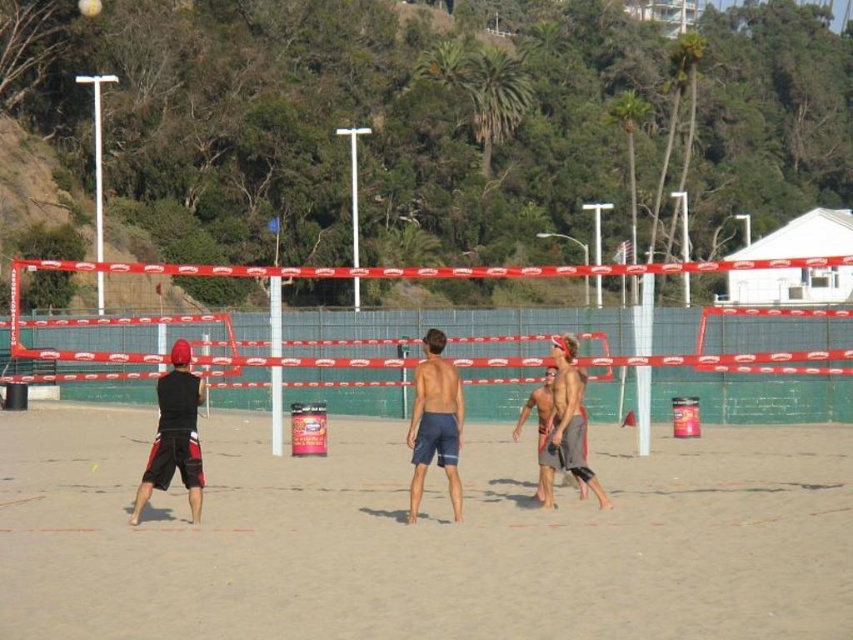
You are a photographer standing at the edge of the beach volleyball court. You want to take a photo of the blue textured shorts at center. According to the court coordinates, where should you aim your camera?

The blue textured shorts at center are located at coordinates point (x=434, y=422), so you should aim your camera at that point to capture them.

You are a photographer positioned at the back of the beach volleyball court. You want to take a photo of the blue textured shorts at center and the white matte volleyball at center. Which object will appear larger in your photo?

The blue textured shorts at center will appear larger in the photo because it is closer to the viewer than the white matte volleyball at center.